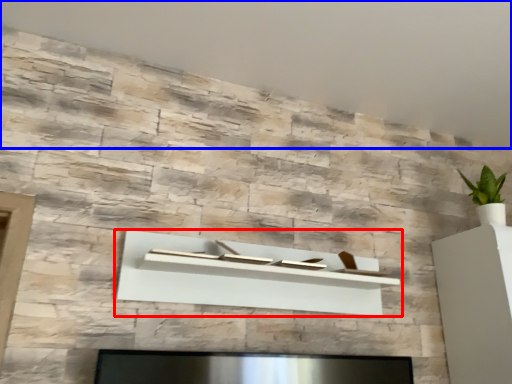
Question: Which point is further to the camera, shelf (highlighted by a red box) or backdrop (highlighted by a blue box)?

Choices:
 (A) shelf
 (B) backdrop

Answer: (A)